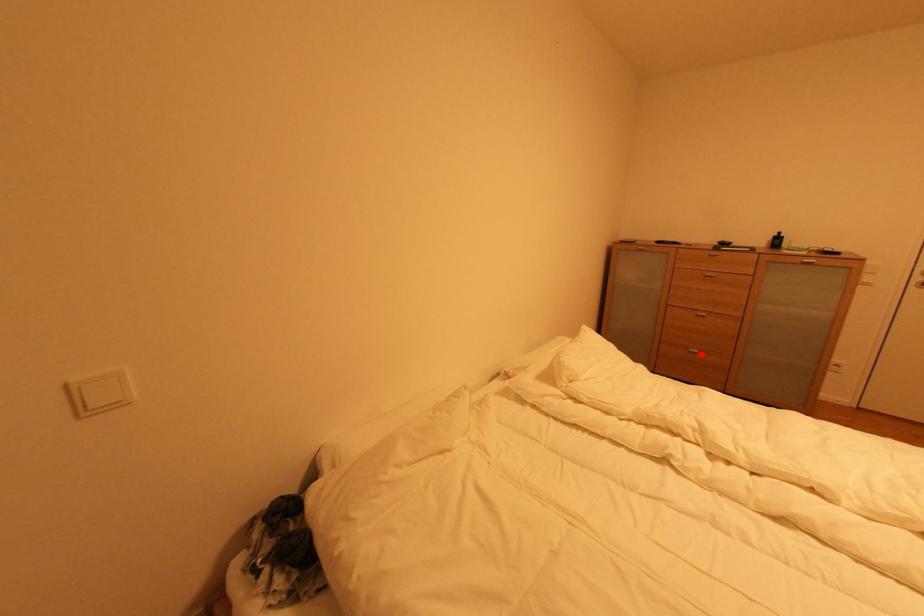
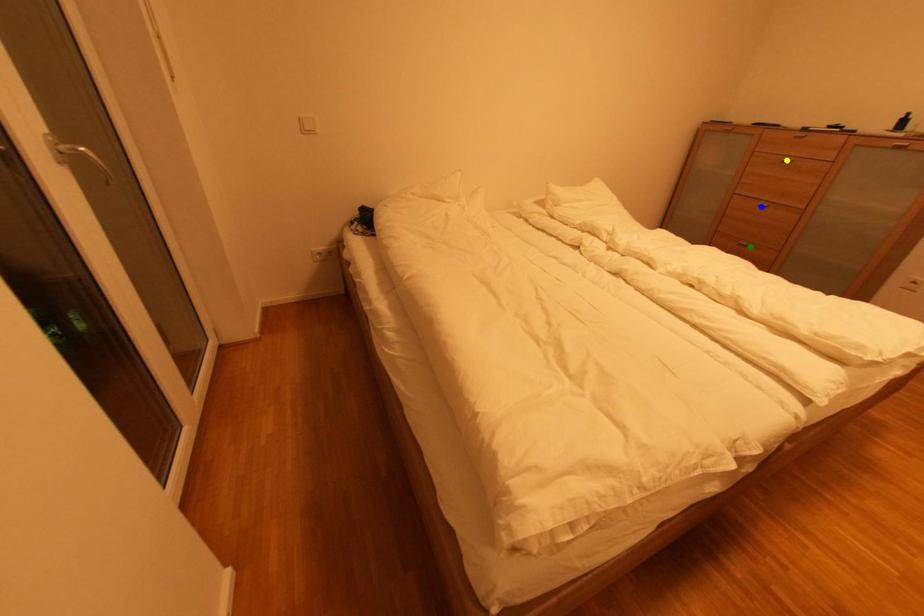
Question: I am providing you with two images of the same scene from different viewpoints. A red point is marked on the first image. You are given multiple points on the second image. Which point in image 2 is actually the same real-world point as the red point in image 1?

Choices:
 (A) yellow point
 (B) blue point
 (C) green point

Answer: (C)